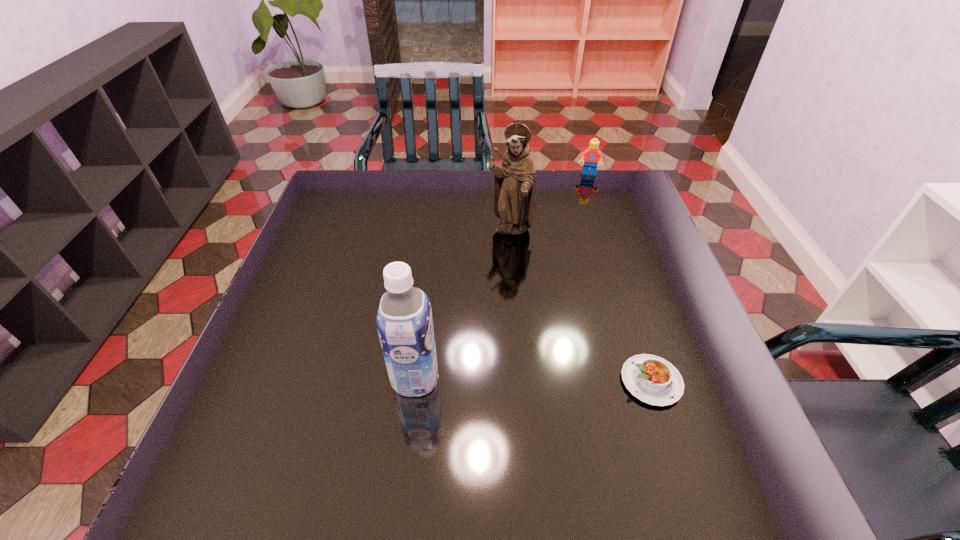
Where is `vacant point located between the Lego and the soya milk`? vacant point located between the Lego and the soya milk is located at coordinates (502, 276).

Locate an element on the screen. Image resolution: width=960 pixels, height=540 pixels. unoccupied area between the third tallest object and the soya milk is located at coordinates (502, 276).

This screenshot has height=540, width=960. What are the coordinates of `free area in between the pudding and the farthest object` in the screenshot? It's located at (620, 278).

Identify the location of vacant space in between the third object from right to left and the farthest object. Image resolution: width=960 pixels, height=540 pixels. (549, 202).

This screenshot has width=960, height=540. In order to click on vacant area that lies between the shortest object and the leftmost object in this screenshot , I will do `click(534, 380)`.

Image resolution: width=960 pixels, height=540 pixels. What are the coordinates of `free spot between the Lego and the figurine` in the screenshot? It's located at [x=549, y=202].

I want to click on unoccupied position between the shortest object and the third nearest object, so click(581, 306).

Locate an element on the screen. This screenshot has width=960, height=540. vacant area that lies between the shortest object and the figurine is located at coordinates (581, 306).

Find the location of a particular element. free spot between the leftmost object and the second farthest object is located at coordinates (463, 305).

Where is `object that is the second closest to the shortest object`? object that is the second closest to the shortest object is located at coordinates (514, 196).